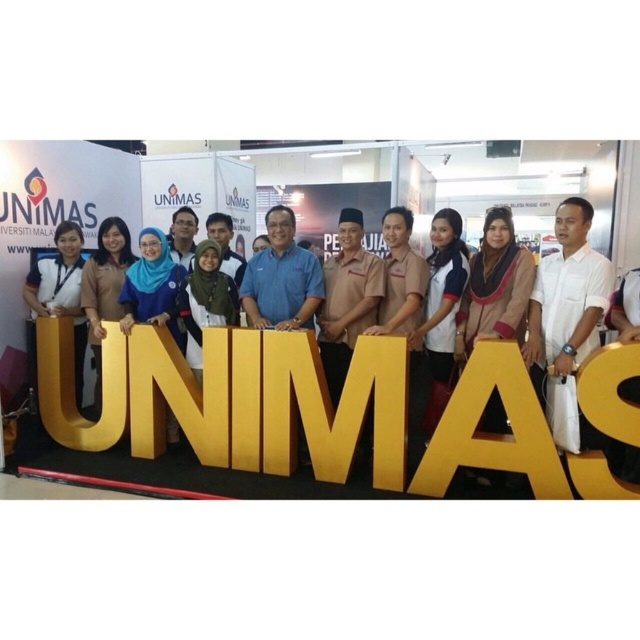
Question: Is matte gold letter at center positioned behind white cotton shirt at center?

Choices:
 (A) yes
 (B) no

Answer: (B)

Question: Does matte gold letter at center have a larger size compared to white cotton shirt at center?

Choices:
 (A) yes
 (B) no

Answer: (A)

Question: Which of these objects is positioned farthest from the white cotton shirt at center?

Choices:
 (A) matte black shirt at left
 (B) matte gold letter at center

Answer: (A)

Question: Observing the image, what is the correct spatial positioning of matte gold letter at center in reference to white cotton shirt at center?

Choices:
 (A) left
 (B) right

Answer: (A)

Question: Which point is farther to the camera?

Choices:
 (A) matte gold letter at center
 (B) matte black shirt at left

Answer: (B)

Question: Among these objects, which one is farthest from the camera?

Choices:
 (A) white cotton shirt at center
 (B) matte gold letter at center
 (C) matte black shirt at left

Answer: (C)